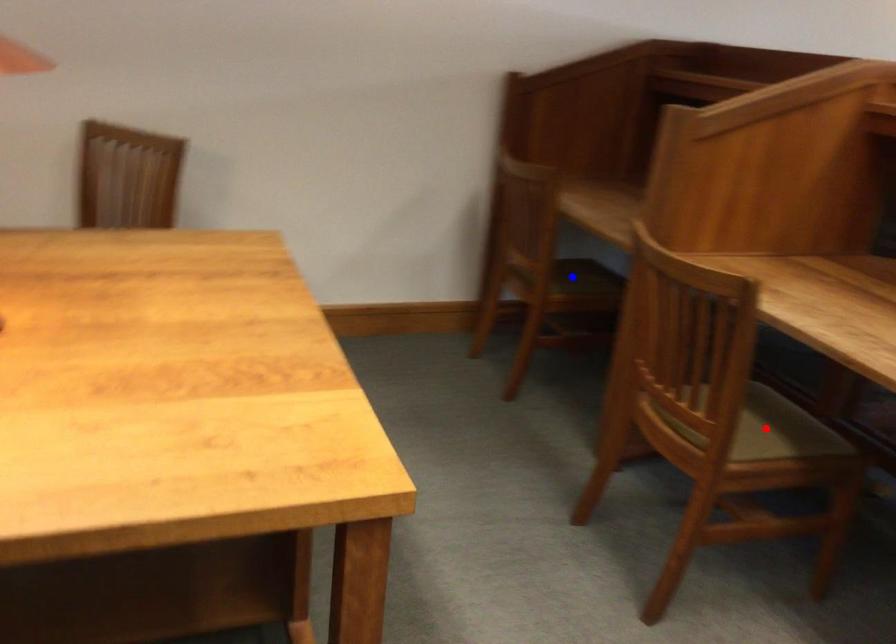
Question: Two points are marked on the image. Which point is closer to the camera?

Choices:
 (A) Blue point is closer.
 (B) Red point is closer.

Answer: (B)